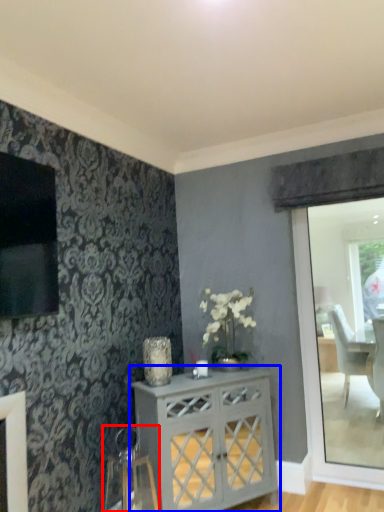
Question: Which of the following is the farthest to the observer, swivel chair (highlighted by a red box) or desk (highlighted by a blue box)?

Choices:
 (A) swivel chair
 (B) desk

Answer: (B)